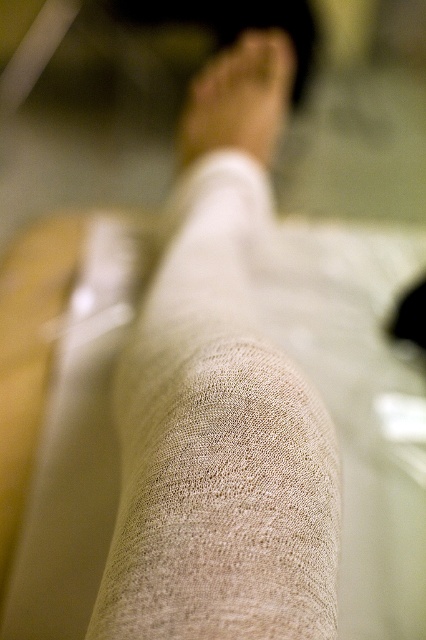
Based on the photo, you are a fashion designer analyzing a closeup image of a leg and foot. The image shows a beige knitted leg at center marked by point (218, 445). You need to determine the position of this point relative to the foot. Is the point closer to the toes or the ankle?

The beige knitted leg at center is represented by point (218, 445). Since the foot is partially visible at the top of the frame with the toes slightly spread apart, the point is closer to the ankle rather than the toes.

You are designing a sock that needs to fit over both the beige knitted leg at center and the beige fabric foot at center. Based on their widths, which part requires the wider sock?

The beige fabric foot at center requires a wider sock since its width is greater than the beige knitted leg at center.

You are a fashion designer examining a closeup image of a person wearing beige knitted leg at center and beige fabric foot at center. Based on their spatial arrangement, which object is positioned lower in the image?

The beige knitted leg at center is positioned below the beige fabric foot at center, so the beige knitted leg at center is lower in the image.